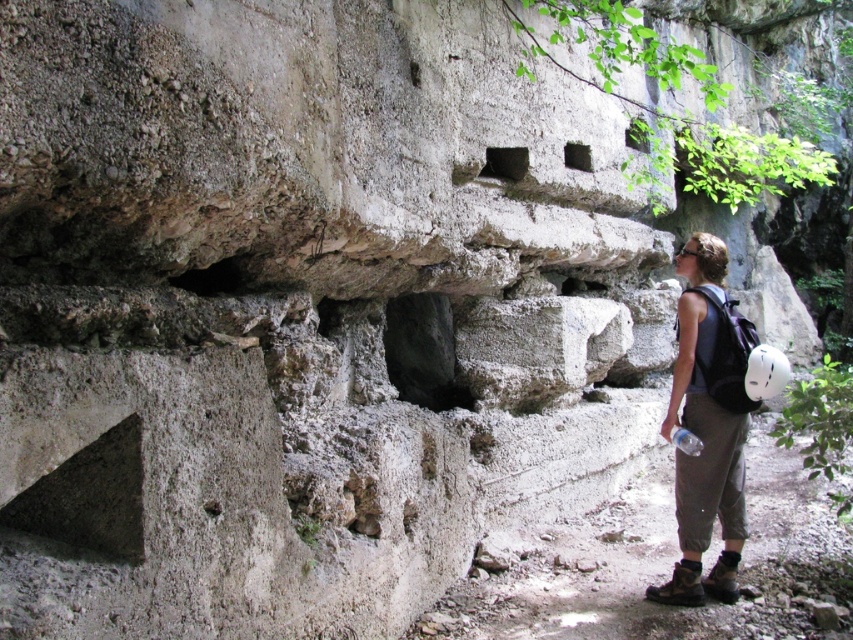
Question: From the image, what is the correct spatial relationship of dark gray fabric backpack at right in relation to dark stone cave at center?

Choices:
 (A) above
 (B) below

Answer: (B)

Question: Is dark gray fabric backpack at right positioned at the back of dark stone cave at center?

Choices:
 (A) yes
 (B) no

Answer: (B)

Question: Which object is farther from the camera taking this photo?

Choices:
 (A) dark stone cave at center
 (B) dark gray fabric backpack at right

Answer: (A)

Question: From the image, what is the correct spatial relationship of dark gray fabric backpack at right in relation to dark stone cave at center?

Choices:
 (A) above
 (B) below

Answer: (B)

Question: Which point is closer to the camera?

Choices:
 (A) dark stone cave at center
 (B) dark gray fabric backpack at right

Answer: (B)

Question: Which point is closer to the camera taking this photo?

Choices:
 (A) (415, 392)
 (B) (688, 394)

Answer: (B)